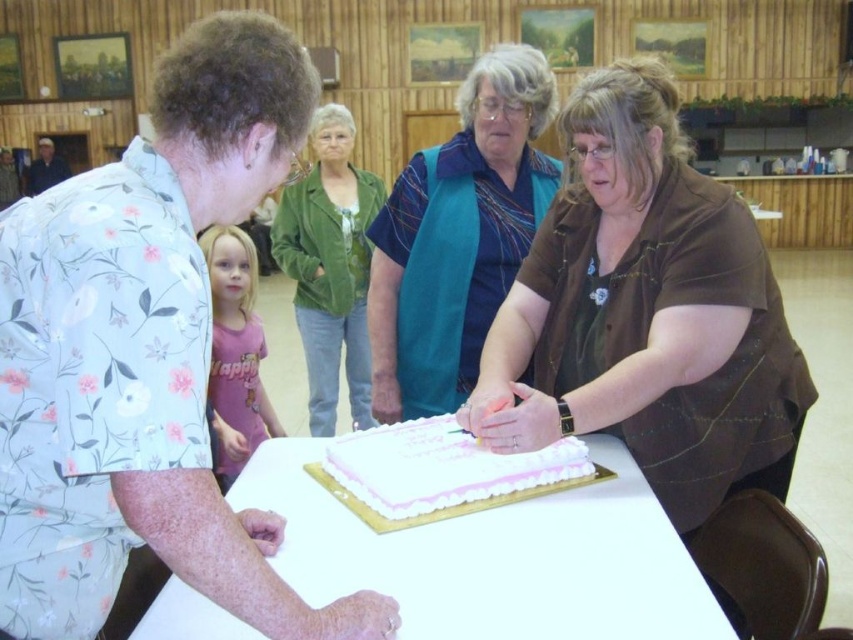
Question: Estimate the real-world distances between objects in this image. Which object is farther from the green suede jacket at upper center?

Choices:
 (A) matte brown shirt at center
 (B) blue fabric vest at center
 (C) white frosted cake at center

Answer: (C)

Question: Which of the following is the farthest from the observer?

Choices:
 (A) (47, 179)
 (B) (445, 385)

Answer: (A)

Question: Is white glossy table at center wider than dark blue shirt at upper left?

Choices:
 (A) yes
 (B) no

Answer: (A)

Question: Which point is farther from the camera taking this photo?

Choices:
 (A) (496, 314)
 (B) (329, 148)

Answer: (B)

Question: Can you confirm if matte floral shirt at left is positioned above blue fabric vest at center?

Choices:
 (A) no
 (B) yes

Answer: (A)

Question: Is matte brown shirt at center below white frosted cake at center?

Choices:
 (A) yes
 (B) no

Answer: (B)